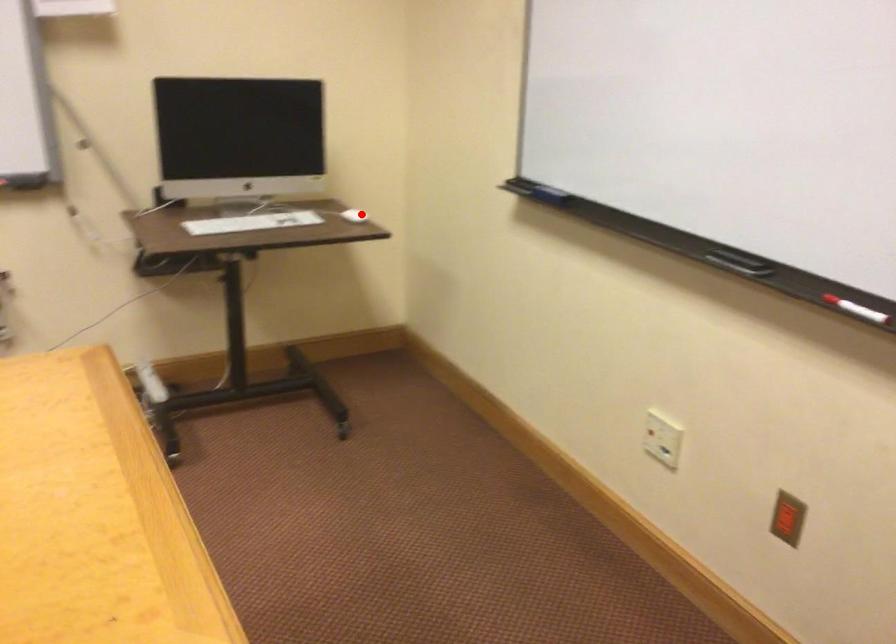
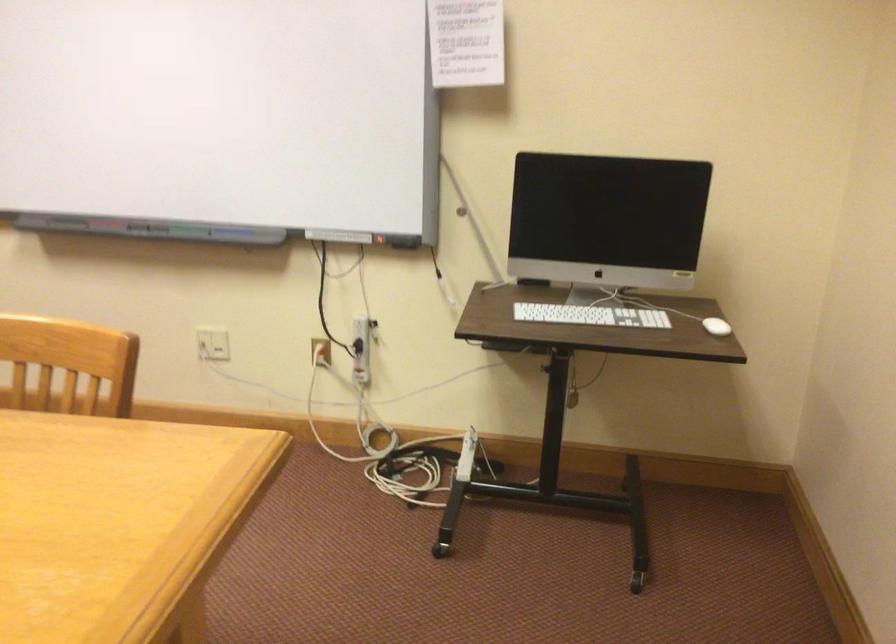
Question: I am providing you with two images of the same scene from different viewpoints. Given a red point in image1, look at the same physical point in image2. Is it:

Choices:
 (A) Closer to the viewpoint
 (B) Farther from the viewpoint

Answer: (A)